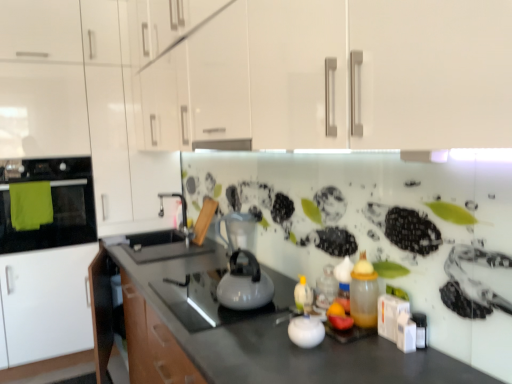
Image resolution: width=512 pixels, height=384 pixels. Describe the element at coordinates (52, 204) in the screenshot. I see `green fabric oven at left` at that location.

Image resolution: width=512 pixels, height=384 pixels. I want to click on white glossy cabinets at upper left, so click(81, 105).

Describe the element at coordinates (325, 289) in the screenshot. I see `translucent plastic bottle at center, which ranks as the second bottle in front-to-back order` at that location.

What do you see at coordinates (364, 293) in the screenshot?
I see `translucent plastic bottle at center-right, positioned as the 2th bottle in back-to-front order` at bounding box center [364, 293].

This screenshot has height=384, width=512. What do you see at coordinates (244, 284) in the screenshot?
I see `white glossy kettle at center` at bounding box center [244, 284].

The image size is (512, 384). Describe the element at coordinates (238, 231) in the screenshot. I see `satin silver kettle at center, the 2th appliance from the right` at that location.

Where is `green fabric oven at left`? green fabric oven at left is located at coordinates tap(52, 204).

Locate an element on the screen. cabinetry lying behind the white glossy kettle at center is located at coordinates (81, 105).

Would you consider white glossy cabinets at upper left to be distant from white glossy kettle at center?

Yes, white glossy cabinets at upper left and white glossy kettle at center are quite far apart.

Relative to white glossy kettle at center, is white glossy cabinets at upper left in front or behind?

white glossy cabinets at upper left is positioned farther from the viewer than white glossy kettle at center.

Considering the relative sizes of white glossy cabinets at upper left and white glossy kettle at center in the image provided, is white glossy cabinets at upper left wider than white glossy kettle at center?

Indeed, white glossy cabinets at upper left has a greater width compared to white glossy kettle at center.

Is green fabric oven at left inside or outside of white glossy cabinets at upper left?

green fabric oven at left is spatially positioned inside white glossy cabinets at upper left.

Based on the photo, how much distance is there between green fabric oven at left and white glossy cabinets at upper left?

A distance of 13.65 inches exists between green fabric oven at left and white glossy cabinets at upper left.

From a real-world perspective, who is located higher, green fabric oven at left or white glossy cabinets at upper left?

From a 3D spatial view, white glossy cabinets at upper left is above.

Visually, is green fabric oven at left positioned to the left or to the right of white glossy cabinets at upper left?

green fabric oven at left is positioned on white glossy cabinets at upper left's left side.

Where is `kitchen appliance in front of the satin silver kettle at center, the 1th appliance from the top`? kitchen appliance in front of the satin silver kettle at center, the 1th appliance from the top is located at coordinates (244, 284).

Considering the relative sizes of white glossy kettle at center and satin silver kettle at center, which is the 2th appliance in front-to-back order, in the image provided, is white glossy kettle at center shorter than satin silver kettle at center, which is the 2th appliance in front-to-back order,?

Yes.

From the image's perspective, is white glossy kettle at center above or below satin silver kettle at center, which is the first appliance from left to right?

Based on their image positions, white glossy kettle at center is located beneath satin silver kettle at center, which is the first appliance from left to right.

Which is farther, (360, 299) or (257, 275)?

The point (257, 275) is farther.

Between translucent plastic bottle at center-right, which ranks as the first bottle in front-to-back order, and white glossy kettle at center, which one is positioned in front?

A: translucent plastic bottle at center-right, which ranks as the first bottle in front-to-back order.

Are translucent plastic bottle at center-right, positioned as the 2th bottle in back-to-front order, and white glossy kettle at center making contact?

No, translucent plastic bottle at center-right, positioned as the 2th bottle in back-to-front order, is not in contact with white glossy kettle at center.

Between translucent plastic bottle at center-right, which ranks as the first bottle in front-to-back order, and white glossy kettle at center, which one has less height?

white glossy kettle at center.

In the scene shown: Could you measure the distance between translucent plastic bottle at center-right, which ranks as the first bottle in front-to-back order, and white glossy jar at center, which ranks as the 2th appliance in top-to-bottom order?

A: A distance of 16.82 centimeters exists between translucent plastic bottle at center-right, which ranks as the first bottle in front-to-back order, and white glossy jar at center, which ranks as the 2th appliance in top-to-bottom order.

Between translucent plastic bottle at center-right, positioned as the 2th bottle in back-to-front order, and white glossy jar at center, the second appliance viewed from the left, which one has larger size?

translucent plastic bottle at center-right, positioned as the 2th bottle in back-to-front order.

Is translucent plastic bottle at center-right, positioned as the 2th bottle in back-to-front order, at the left side of white glossy jar at center, the first appliance positioned from the bottom?

Incorrect, translucent plastic bottle at center-right, positioned as the 2th bottle in back-to-front order, is not on the left side of white glossy jar at center, the first appliance positioned from the bottom.

From the image's perspective, relative to white glossy jar at center, the 1th appliance in the right-to-left sequence, is translucent plastic bottle at center-right, positioned as the 2th bottle in back-to-front order, above or below?

Clearly, from the image's perspective, translucent plastic bottle at center-right, positioned as the 2th bottle in back-to-front order, is above white glossy jar at center, the 1th appliance in the right-to-left sequence.

Which is more to the left, green fabric oven at left or white glossy jar at center, the second appliance viewed from the left?

green fabric oven at left is more to the left.

From a real-world perspective, which object stands above the other?

green fabric oven at left is physically above.

Is white glossy jar at center, the 1th appliance in the right-to-left sequence, at the back of green fabric oven at left?

No, green fabric oven at left's orientation is not away from white glossy jar at center, the 1th appliance in the right-to-left sequence.

From the image's perspective, is green fabric oven at left below white glossy jar at center, marked as the 1th appliance in a front-to-back arrangement?

No.

Is satin silver kettle at center, which is the 2th appliance in front-to-back order, bigger or smaller than white glossy cabinets at upper left?

satin silver kettle at center, which is the 2th appliance in front-to-back order, is smaller than white glossy cabinets at upper left.

Is satin silver kettle at center, which is the first appliance from left to right, oriented towards white glossy cabinets at upper left?

No.

Consider the image. Between satin silver kettle at center, which is the 2th appliance in front-to-back order, and white glossy cabinets at upper left, which one has larger width?

With larger width is white glossy cabinets at upper left.

Image resolution: width=512 pixels, height=384 pixels. I want to click on cabinetry on the left of white glossy kettle at center, so tap(81, 105).

You are a GUI agent. You are given a task and a screenshot of the screen. Output one action in this format:
    pyautogui.click(x=<x>, y=<y>)
    Task: Click on the cabinetry in front of the green fabric oven at left
    The image size is (512, 384).
    Given the screenshot: What is the action you would take?
    pyautogui.click(x=81, y=105)

From the image, which object appears to be nearer to translucent plastic bottle at center, which ranks as the second bottle in front-to-back order, green fabric oven at left or white glossy jar at center, marked as the 1th appliance in a front-to-back arrangement?

white glossy jar at center, marked as the 1th appliance in a front-to-back arrangement, is positioned closer to the anchor translucent plastic bottle at center, which ranks as the second bottle in front-to-back order.

Which object lies further to the anchor point translucent plastic bottle at center-right, positioned as the 2th bottle in back-to-front order, satin silver kettle at center, the 2th appliance ordered from the bottom, or white glossy jar at center, marked as the 1th appliance in a front-to-back arrangement?

satin silver kettle at center, the 2th appliance ordered from the bottom, lies further to translucent plastic bottle at center-right, positioned as the 2th bottle in back-to-front order, than the other object.

From the image, which object appears to be nearer to translucent plastic bottle at center-right, which ranks as the first bottle in front-to-back order, white glossy jar at center, marked as the 1th appliance in a front-to-back arrangement, or satin silver kettle at center, the 2th appliance from the right?

white glossy jar at center, marked as the 1th appliance in a front-to-back arrangement, lies closer to translucent plastic bottle at center-right, which ranks as the first bottle in front-to-back order, than the other object.

From the image, which object appears to be nearer to satin silver kettle at center, the 2th appliance from the right, white glossy cabinets at upper left or white glossy jar at center, which ranks as the 2th appliance in top-to-bottom order?

white glossy jar at center, which ranks as the 2th appliance in top-to-bottom order, lies closer to satin silver kettle at center, the 2th appliance from the right, than the other object.

When comparing their distances from translucent plastic bottle at center-right, which ranks as the first bottle in front-to-back order, does white glossy kettle at center or satin silver kettle at center, the 1th appliance from the top, seem further?

satin silver kettle at center, the 1th appliance from the top, is further to translucent plastic bottle at center-right, which ranks as the first bottle in front-to-back order.

Estimate the real-world distances between objects in this image. Which object is closer to satin silver kettle at center, the 1th appliance from the top, translucent plastic bottle at center, which ranks as the second bottle in front-to-back order, or translucent plastic bottle at center-right, which ranks as the first bottle in front-to-back order?

translucent plastic bottle at center, which ranks as the second bottle in front-to-back order, is closer to satin silver kettle at center, the 1th appliance from the top.

Considering their positions, is translucent plastic bottle at center-right, positioned as the 2th bottle in back-to-front order, positioned closer to white glossy cabinets at upper left than satin silver kettle at center, which is the first appliance from left to right?

Among the two, satin silver kettle at center, which is the first appliance from left to right, is located nearer to white glossy cabinets at upper left.

From the image, which object appears to be farther from white glossy cabinets at upper left, white glossy kettle at center or white glossy jar at center, the second appliance viewed from the left?

white glossy jar at center, the second appliance viewed from the left, lies further to white glossy cabinets at upper left than the other object.

You are a GUI agent. You are given a task and a screenshot of the screen. Output one action in this format:
    pyautogui.click(x=<x>, y=<y>)
    Task: Click on the cabinetry between green fabric oven at left and white glossy jar at center, the 1th appliance in the right-to-left sequence
    
    Given the screenshot: What is the action you would take?
    point(81,105)

Where is `appliance situated between green fabric oven at left and white glossy kettle at center from left to right`? Image resolution: width=512 pixels, height=384 pixels. appliance situated between green fabric oven at left and white glossy kettle at center from left to right is located at coordinates (238, 231).

You are a GUI agent. You are given a task and a screenshot of the screen. Output one action in this format:
    pyautogui.click(x=<x>, y=<y>)
    Task: Click on the appliance between white glossy cabinets at upper left and white glossy kettle at center
    The width and height of the screenshot is (512, 384).
    Given the screenshot: What is the action you would take?
    pyautogui.click(x=238, y=231)

The image size is (512, 384). Identify the location of cabinetry situated between green fabric oven at left and satin silver kettle at center, which is the 2th appliance in front-to-back order, from left to right. (81, 105).